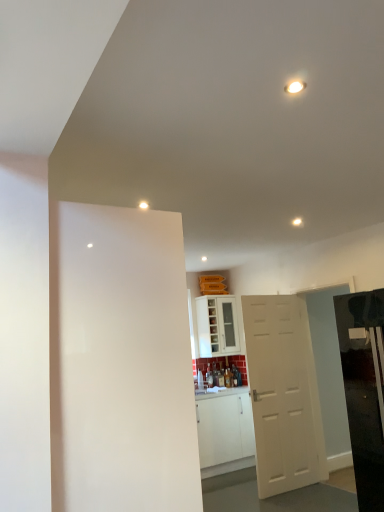
Where is `empty space that is to the right of white glossy light at upper center`? The height and width of the screenshot is (512, 384). empty space that is to the right of white glossy light at upper center is located at coordinates (170, 203).